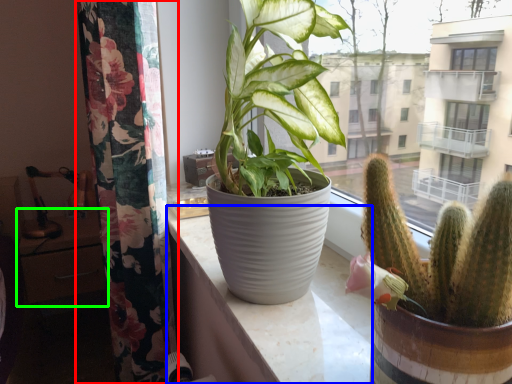
Question: Estimate the real-world distances between objects in this image. Which object is closer to curtain (highlighted by a red box), counter top (highlighted by a blue box) or table (highlighted by a green box)?

Choices:
 (A) counter top
 (B) table

Answer: (A)